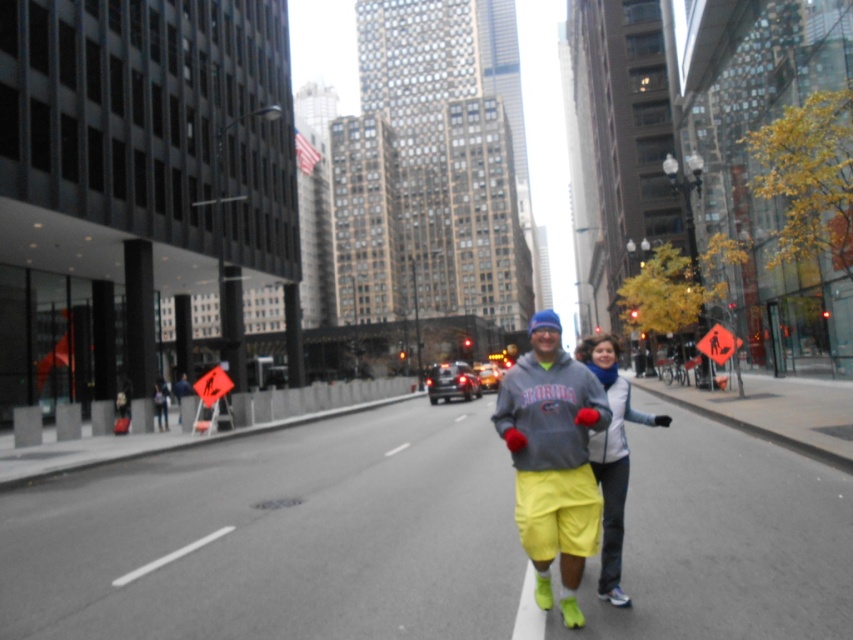
Can you confirm if matte gray hoodie at center is positioned below yellow fabric pants at center?

No.

Is point (605, 400) positioned after point (618, 344)?

No, (605, 400) is in front of (618, 344).

Which is behind, point (560, 380) or point (616, 564)?

Positioned behind is point (616, 564).

Where is `matte gray hoodie at center`? This screenshot has height=640, width=853. matte gray hoodie at center is located at coordinates (564, 460).